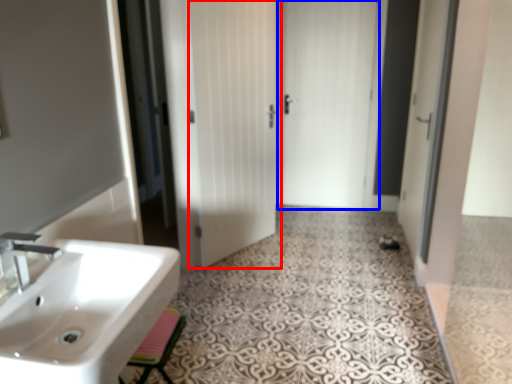
Question: Which object appears closest to the camera in this image, door (highlighted by a red box) or door (highlighted by a blue box)?

Choices:
 (A) door
 (B) door

Answer: (A)